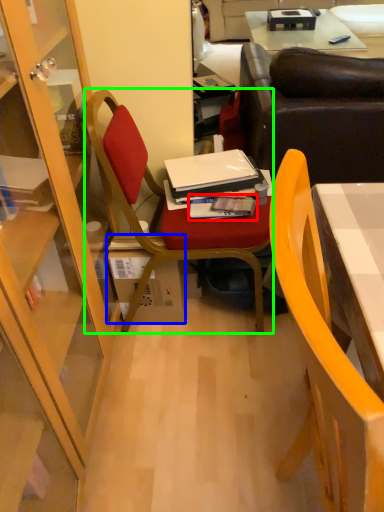
Question: Estimate the real-world distances between objects in this image. Which object is closer to magazine (highlighted by a red box), box (highlighted by a blue box) or chair (highlighted by a green box)?

Choices:
 (A) box
 (B) chair

Answer: (B)